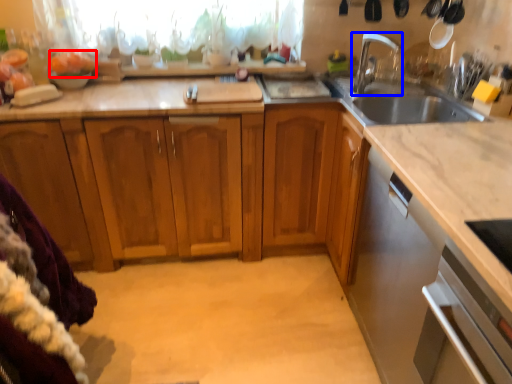
Question: Which object appears closest to the camera in this image, food (highlighted by a red box) or tap (highlighted by a blue box)?

Choices:
 (A) food
 (B) tap

Answer: (B)